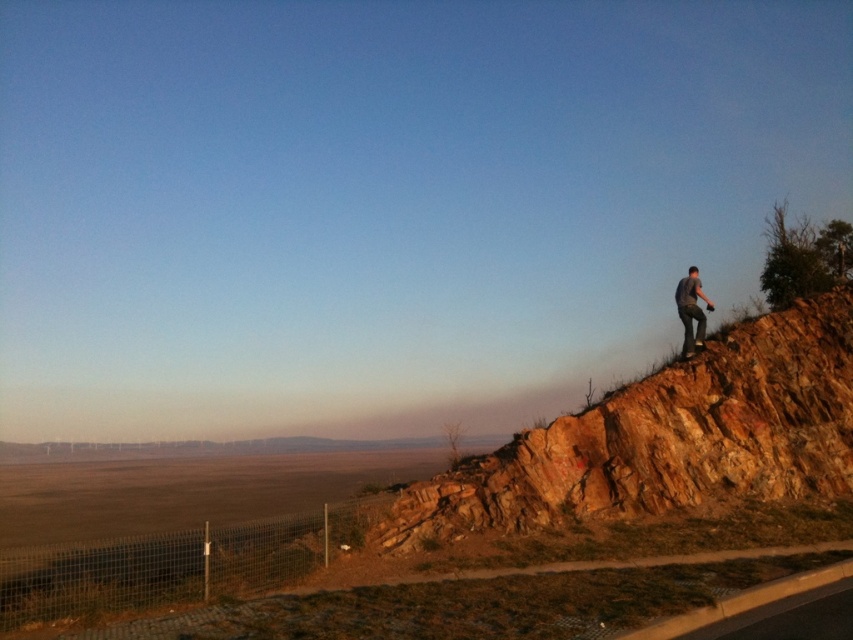
Question: Which object appears closest to the camera in this image?

Choices:
 (A) dark gray shirt at upper right
 (B) rustic stone hillside at upper right

Answer: (B)

Question: Among these points, which one is nearest to the camera?

Choices:
 (A) (691, 403)
 (B) (683, 348)

Answer: (A)

Question: From the image, what is the correct spatial relationship of rustic stone hillside at upper right in relation to dark gray shirt at upper right?

Choices:
 (A) below
 (B) above

Answer: (A)

Question: Does rustic stone hillside at upper right lie in front of dark gray shirt at upper right?

Choices:
 (A) yes
 (B) no

Answer: (A)

Question: Which of the following is the closest to the observer?

Choices:
 (A) (699, 284)
 (B) (816, 360)

Answer: (B)

Question: Is rustic stone hillside at upper right behind dark gray shirt at upper right?

Choices:
 (A) yes
 (B) no

Answer: (B)